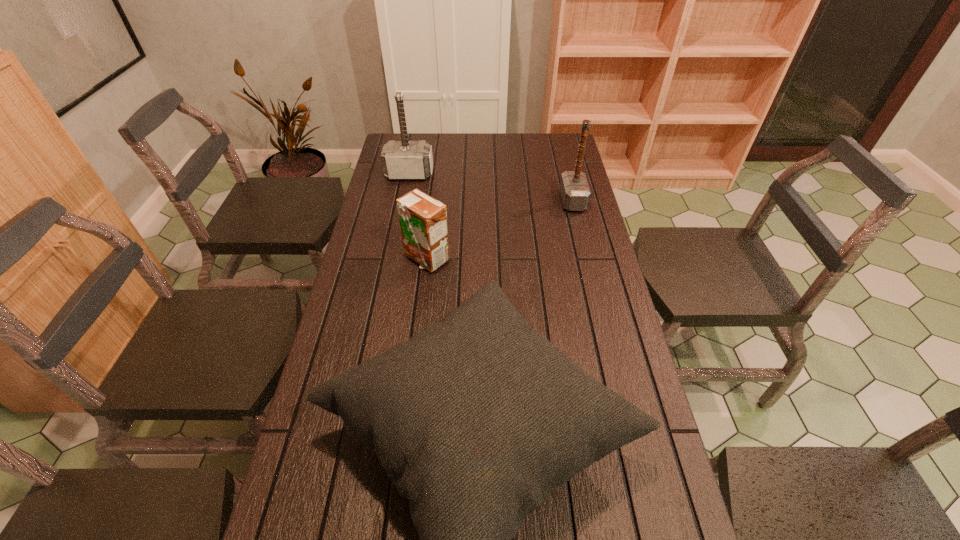
Identify the location of the left hammer. This screenshot has width=960, height=540. (402, 160).

Where is `the farthest object`? This screenshot has height=540, width=960. the farthest object is located at coordinates (402, 160).

At what (x,y) coordinates should I click in order to perform the action: click on the second farthest object. Please return your answer as a coordinate pair (x, y). The width and height of the screenshot is (960, 540). Looking at the image, I should click on (575, 193).

You are a GUI agent. You are given a task and a screenshot of the screen. Output one action in this format:
    pyautogui.click(x=<x>, y=<y>)
    Task: Click on the nearer hammer
    The image size is (960, 540).
    Given the screenshot: What is the action you would take?
    pyautogui.click(x=575, y=193)

Find the location of a particular element. The image size is (960, 540). the third farthest object is located at coordinates (423, 220).

You are a GUI agent. You are given a task and a screenshot of the screen. Output one action in this format:
    pyautogui.click(x=<x>, y=<y>)
    Task: Click on the shortest object
    This screenshot has width=960, height=540.
    Given the screenshot: What is the action you would take?
    pyautogui.click(x=423, y=220)

This screenshot has width=960, height=540. What are the coordinates of `free space located for striking with the head of the left hammer` in the screenshot? It's located at (406, 192).

At what (x,y) coordinates should I click in order to perform the action: click on free space located on the striking surface of the right hammer. Please return your answer as a coordinate pair (x, y). The image size is (960, 540). Looking at the image, I should click on (514, 201).

Where is `free spot located 0.400m on the striking surface of the right hammer`? free spot located 0.400m on the striking surface of the right hammer is located at coordinates (449, 201).

You are a GUI agent. You are given a task and a screenshot of the screen. Output one action in this format:
    pyautogui.click(x=<x>, y=<y>)
    Task: Click on the free space located on the striking surface of the right hammer
    The height and width of the screenshot is (540, 960).
    Given the screenshot: What is the action you would take?
    pyautogui.click(x=499, y=201)